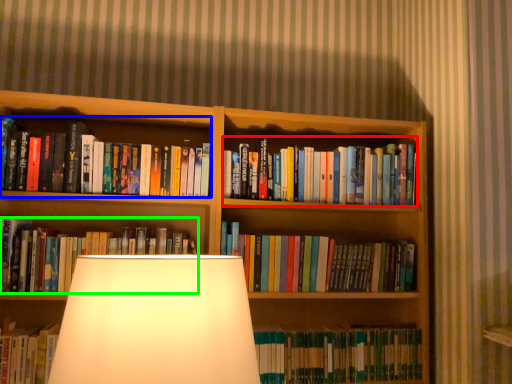
Question: Based on their relative distances, which object is farther from book (highlighted by a red box)? Choose from book (highlighted by a blue box) and book (highlighted by a green box).

Choices:
 (A) book
 (B) book

Answer: (B)